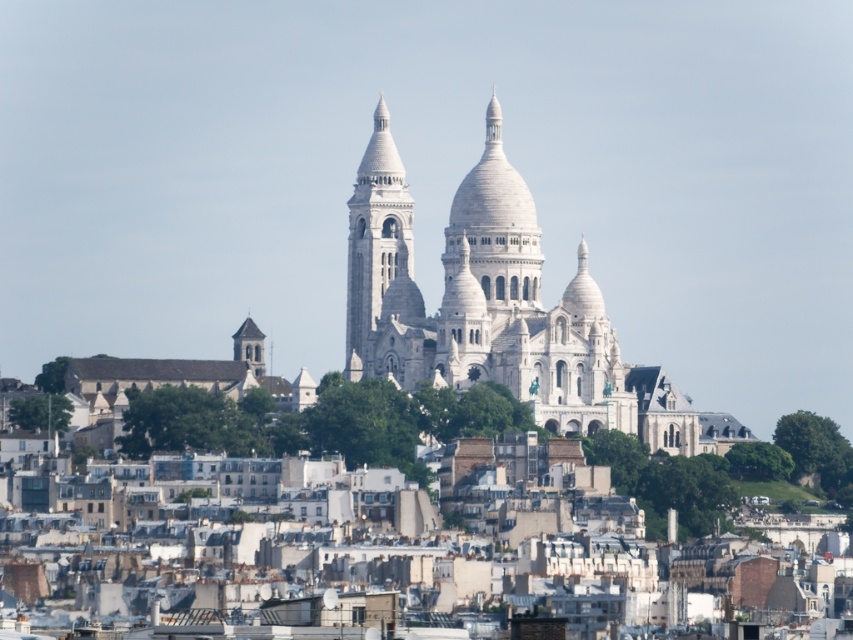
Question: Is white stone tower at center further to the viewer compared to smooth gray stone tower at lower left?

Choices:
 (A) no
 (B) yes

Answer: (A)

Question: Does white stone tower at center have a larger size compared to smooth gray stone tower at lower left?

Choices:
 (A) no
 (B) yes

Answer: (B)

Question: Where is white stone tower at center located in relation to smooth gray stone tower at lower left in the image?

Choices:
 (A) left
 (B) right

Answer: (B)

Question: Which object is farther from the camera taking this photo?

Choices:
 (A) smooth gray stone tower at lower left
 (B) white stone tower at center

Answer: (A)